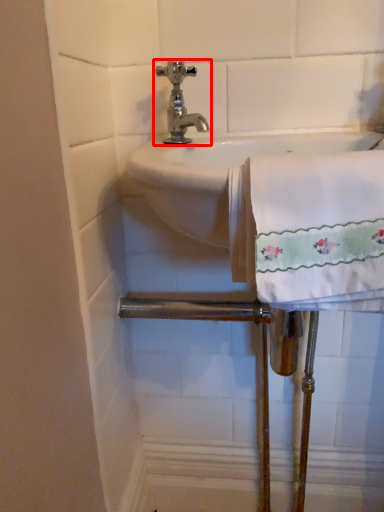
Question: From the image's perspective, considering the relative positions of tap (annotated by the red box) and bath towel in the image provided, where is tap (annotated by the red box) located with respect to the staircase?

Choices:
 (A) below
 (B) above

Answer: (B)